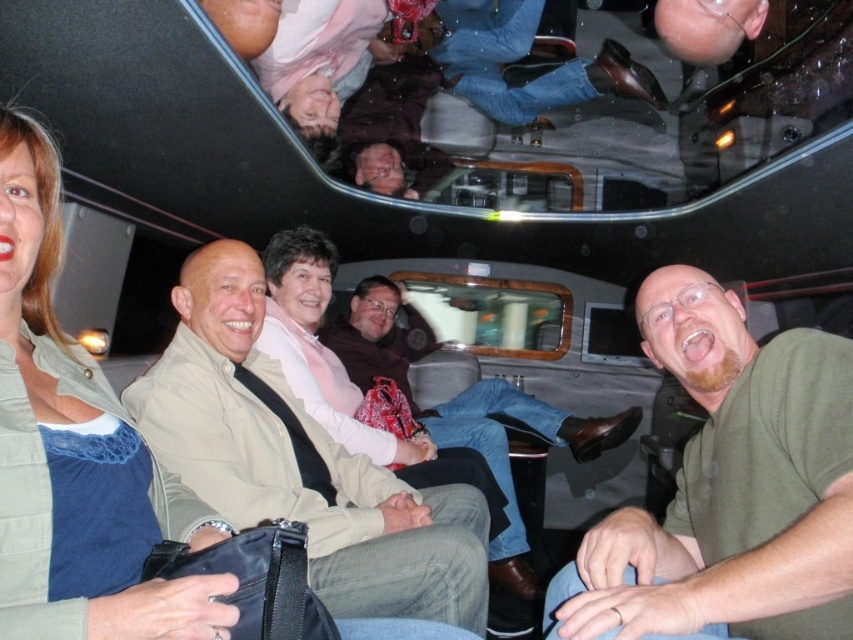
Is beige fabric shirt at center shorter than brown leather jacket at center?

Indeed, beige fabric shirt at center has a lesser height compared to brown leather jacket at center.

Measure the distance between point (206, 252) and camera.

Point (206, 252) and camera are 6.89 feet apart from each other.

Does point (309, 428) come farther from viewer compared to point (393, 324)?

That is False.

Locate an element on the screen. beige fabric shirt at center is located at coordinates tap(300, 460).

Describe the element at coordinates (729, 486) in the screenshot. I see `green matte shirt at center` at that location.

Locate an element on the screen. green matte shirt at center is located at coordinates (729, 486).

Does denim shirt at left appear on the left side of brown leather jacket at center?

Correct, you'll find denim shirt at left to the left of brown leather jacket at center.

Can you confirm if denim shirt at left is bigger than brown leather jacket at center?

Actually, denim shirt at left might be smaller than brown leather jacket at center.

Between point (47, 432) and point (338, 316), which one is positioned behind?

Positioned behind is point (338, 316).

Where is `denim shirt at left`? Image resolution: width=853 pixels, height=640 pixels. denim shirt at left is located at coordinates (76, 452).